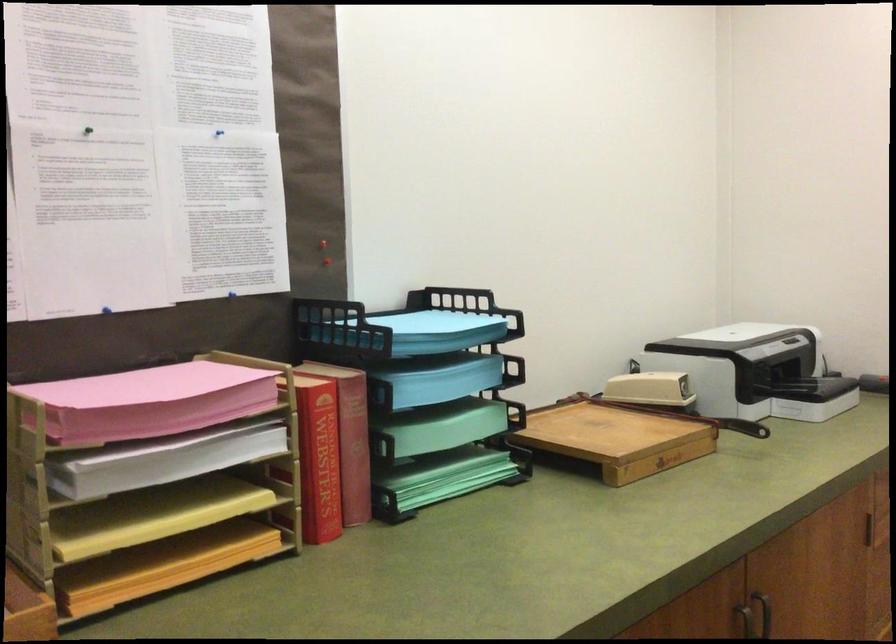
Where would you pull the dark cabinet handle? Please return your answer as a coordinate pair (x, y).

(746, 623)